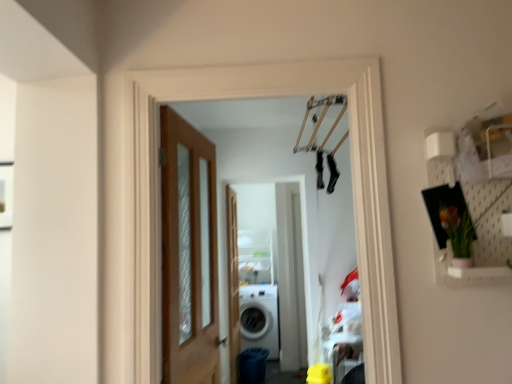
Question: Is wooden door at left bigger than clear wood screen door at center?

Choices:
 (A) yes
 (B) no

Answer: (A)

Question: Does wooden door at left lie behind clear wood screen door at center?

Choices:
 (A) yes
 (B) no

Answer: (B)

Question: From the image's perspective, is wooden door at left under clear wood screen door at center?

Choices:
 (A) yes
 (B) no

Answer: (B)

Question: Is wooden door at left positioned far away from clear wood screen door at center?

Choices:
 (A) no
 (B) yes

Answer: (B)

Question: Would you say clear wood screen door at center is part of wooden door at left's contents?

Choices:
 (A) yes
 (B) no

Answer: (B)

Question: Based on their positions, is wooden door at left located to the left or right of white glossy washing machine at center?

Choices:
 (A) left
 (B) right

Answer: (A)

Question: From a real-world perspective, relative to white glossy washing machine at center, is wooden door at left vertically above or below?

Choices:
 (A) above
 (B) below

Answer: (A)

Question: Based on their sizes in the image, would you say wooden door at left is bigger or smaller than white glossy washing machine at center?

Choices:
 (A) big
 (B) small

Answer: (B)

Question: In terms of width, does wooden door at left look wider or thinner when compared to white glossy washing machine at center?

Choices:
 (A) wide
 (B) thin

Answer: (B)

Question: From the image's perspective, relative to clear wood screen door at center, is wooden door at left above or below?

Choices:
 (A) above
 (B) below

Answer: (A)

Question: Is wooden door at left taller or shorter than clear wood screen door at center?

Choices:
 (A) short
 (B) tall

Answer: (A)

Question: Based on their sizes in the image, would you say wooden door at left is bigger or smaller than clear wood screen door at center?

Choices:
 (A) small
 (B) big

Answer: (B)

Question: In the image, is wooden door at left on the left side or the right side of clear wood screen door at center?

Choices:
 (A) left
 (B) right

Answer: (A)

Question: From their relative heights in the image, would you say white glossy washing machine at center is taller or shorter than clear wood screen door at center?

Choices:
 (A) short
 (B) tall

Answer: (A)

Question: Would you say white glossy washing machine at center is to the left or to the right of clear wood screen door at center in the picture?

Choices:
 (A) right
 (B) left

Answer: (A)